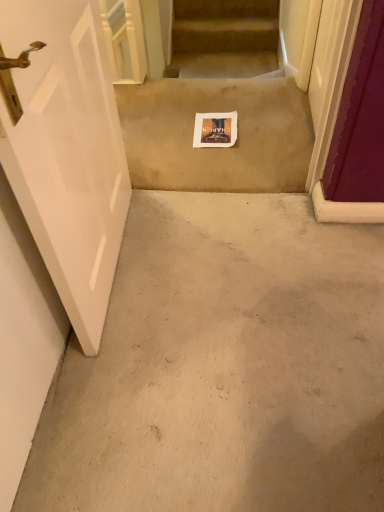
Question: Considering the positions of white glossy door at left and beige carpet at center in the image, is white glossy door at left bigger or smaller than beige carpet at center?

Choices:
 (A) big
 (B) small

Answer: (A)

Question: Visually, is white glossy door at left positioned to the left or to the right of beige carpet at center?

Choices:
 (A) right
 (B) left

Answer: (B)

Question: In terms of height, does white glossy door at left look taller or shorter compared to beige carpet at center?

Choices:
 (A) short
 (B) tall

Answer: (B)

Question: From the image's perspective, is beige carpet at center located above or below white glossy door at left?

Choices:
 (A) above
 (B) below

Answer: (A)

Question: Considering the relative positions of beige carpet at center and white glossy door at left in the image provided, is beige carpet at center to the left or to the right of white glossy door at left?

Choices:
 (A) right
 (B) left

Answer: (A)

Question: From their relative heights in the image, would you say beige carpet at center is taller or shorter than white glossy door at left?

Choices:
 (A) tall
 (B) short

Answer: (B)

Question: Is beige carpet at center in front of or behind white glossy door at left in the image?

Choices:
 (A) behind
 (B) front

Answer: (A)